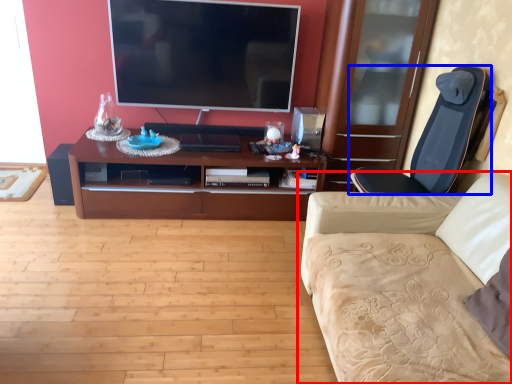
Question: Which object is further to the camera taking this photo, studio couch (highlighted by a red box) or chair (highlighted by a blue box)?

Choices:
 (A) studio couch
 (B) chair

Answer: (B)